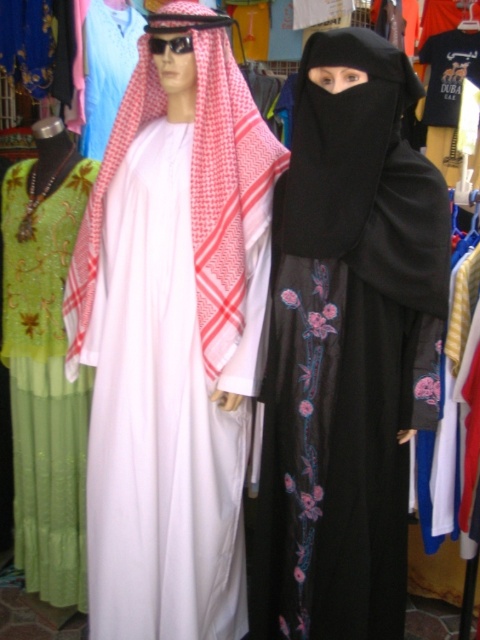
You are a store manager organizing a fashion display. You have two garments to place on a mannequin stand that can only hold items up to the size of the green sequined dress at left. Can the white matte kandura at center be placed on the stand?

The white matte kandura at center is bigger than the green sequined dress at left, so it cannot be placed on the stand as it exceeds the size limit.

You are a fashion designer trying to arrange two garments in a store window. You have a white matte kandura at center and a black matte niqab at center. If you want to display them side by side, which garment should you place on the wider rack to accommodate its size?

The white matte kandura at center has a greater width than the black matte niqab at center, so you should place the white matte kandura at center on the wider rack to accommodate its size.